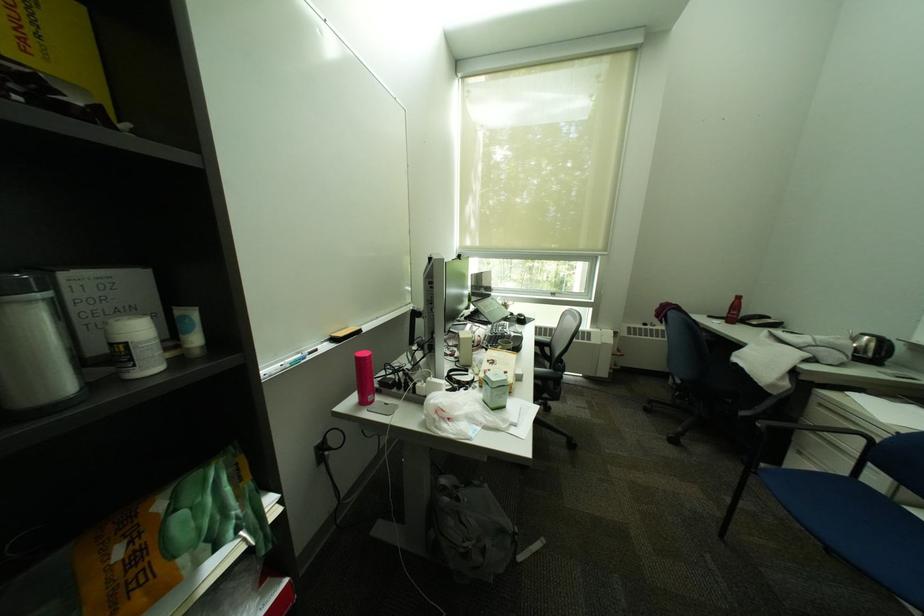
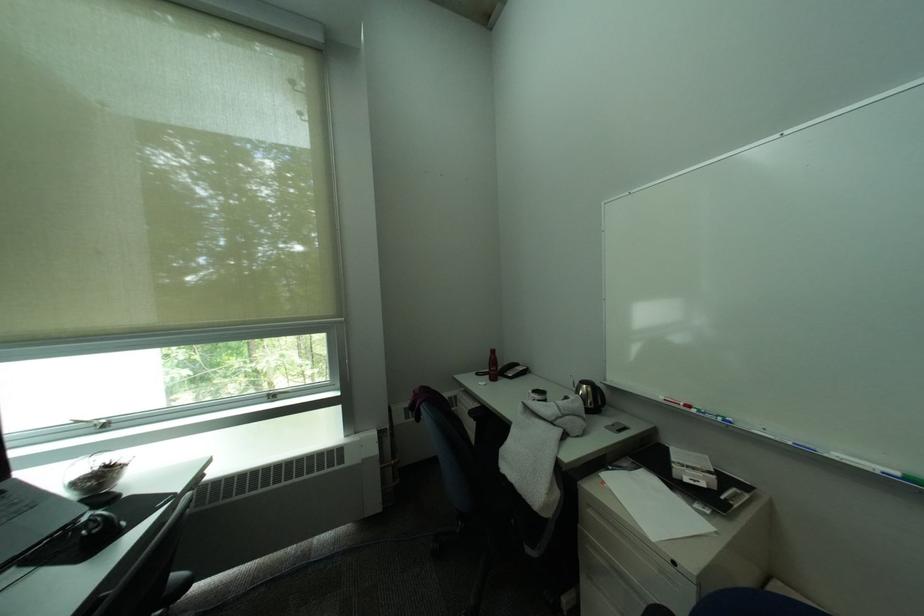
The point at (533, 318) is marked in the first image. Where is the corresponding point in the second image?

(106, 528)